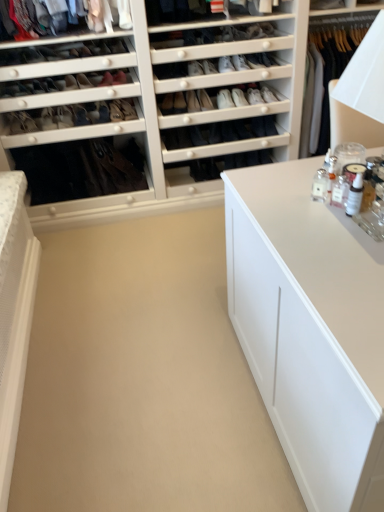
Question: Is matte black shoe at center, which is counted as the 5th shoe, starting from the right, oriented away from matte black shoe at center, marked as the 3th shoe in a right-to-left arrangement?

Choices:
 (A) no
 (B) yes

Answer: (A)

Question: Does matte black shoe at center, which is counted as the 5th shoe, starting from the right, contain matte black shoe at center, the 7th shoe from the left?

Choices:
 (A) no
 (B) yes

Answer: (A)

Question: From the image's perspective, is matte black shoe at center, positioned as the 5th shoe in left-to-right order, located above matte black shoe at center, marked as the 3th shoe in a right-to-left arrangement?

Choices:
 (A) no
 (B) yes

Answer: (A)

Question: Is matte black shoe at center, which is counted as the 5th shoe, starting from the right, further to camera compared to matte black shoe at center, the 7th shoe from the left?

Choices:
 (A) yes
 (B) no

Answer: (A)

Question: Considering the relative sizes of matte black shoe at center, positioned as the 5th shoe in left-to-right order, and matte black shoe at center, the 7th shoe from the left, in the image provided, is matte black shoe at center, positioned as the 5th shoe in left-to-right order, smaller than matte black shoe at center, the 7th shoe from the left,?

Choices:
 (A) no
 (B) yes

Answer: (A)

Question: Is matte black shoe at center, which appears as the fourth shoe when viewed from the left, wider or thinner than matte black shoe at center, positioned as the 5th shoe in left-to-right order?

Choices:
 (A) wide
 (B) thin

Answer: (A)

Question: Looking at the image, does matte black shoe at center, positioned as the 6th shoe in right-to-left order, seem bigger or smaller compared to matte black shoe at center, which is counted as the 5th shoe, starting from the right?

Choices:
 (A) small
 (B) big

Answer: (B)

Question: From their relative heights in the image, would you say matte black shoe at center, which appears as the fourth shoe when viewed from the left, is taller or shorter than matte black shoe at center, positioned as the 5th shoe in left-to-right order?

Choices:
 (A) tall
 (B) short

Answer: (A)

Question: From the image's perspective, is matte black shoe at center, which appears as the fourth shoe when viewed from the left, above or below matte black shoe at center, which is counted as the 5th shoe, starting from the right?

Choices:
 (A) below
 (B) above

Answer: (A)

Question: From a real-world perspective, is white matte cabinet at center physically located above or below white leather shoe at upper center, the eighth shoe in the left-to-right sequence?

Choices:
 (A) below
 (B) above

Answer: (A)

Question: Is white matte cabinet at center spatially inside white leather shoe at upper center, the eighth shoe in the left-to-right sequence, or outside of it?

Choices:
 (A) inside
 (B) outside

Answer: (B)

Question: From the image's perspective, relative to white leather shoe at upper center, which is the 2th shoe in right-to-left order, is white matte cabinet at center above or below?

Choices:
 (A) above
 (B) below

Answer: (B)

Question: Looking at the image, does white matte cabinet at center seem bigger or smaller compared to white leather shoe at upper center, which is the 2th shoe in right-to-left order?

Choices:
 (A) small
 (B) big

Answer: (B)

Question: Is white matte cabinet at center to the left or to the right of matte black shoe at center, positioned as the 6th shoe in right-to-left order, in the image?

Choices:
 (A) right
 (B) left

Answer: (A)

Question: Looking at the image, does white matte cabinet at center seem bigger or smaller compared to matte black shoe at center, which appears as the fourth shoe when viewed from the left?

Choices:
 (A) big
 (B) small

Answer: (A)